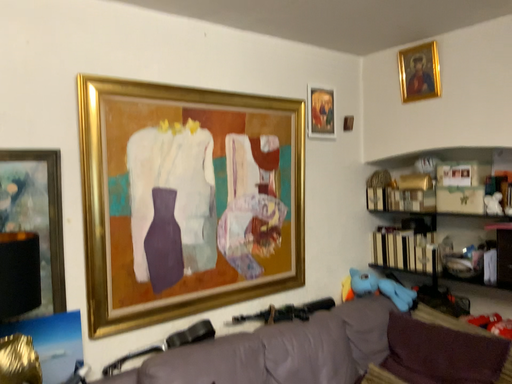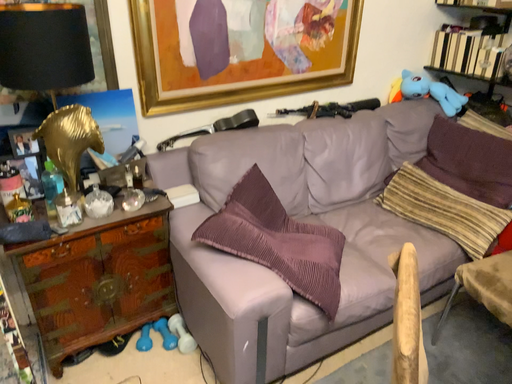
Question: How did the camera likely rotate when shooting the video?

Choices:
 (A) rotated upward
 (B) rotated downward

Answer: (B)